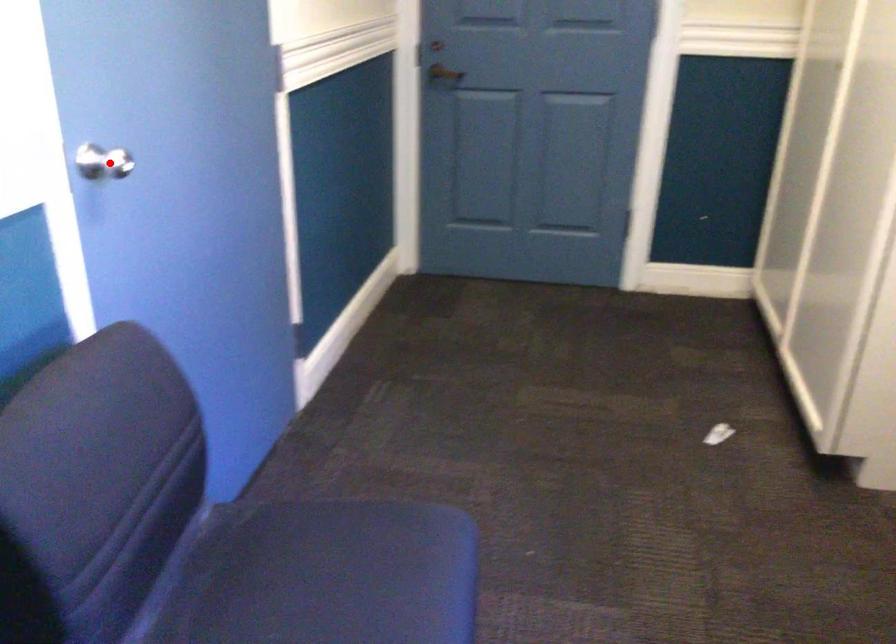
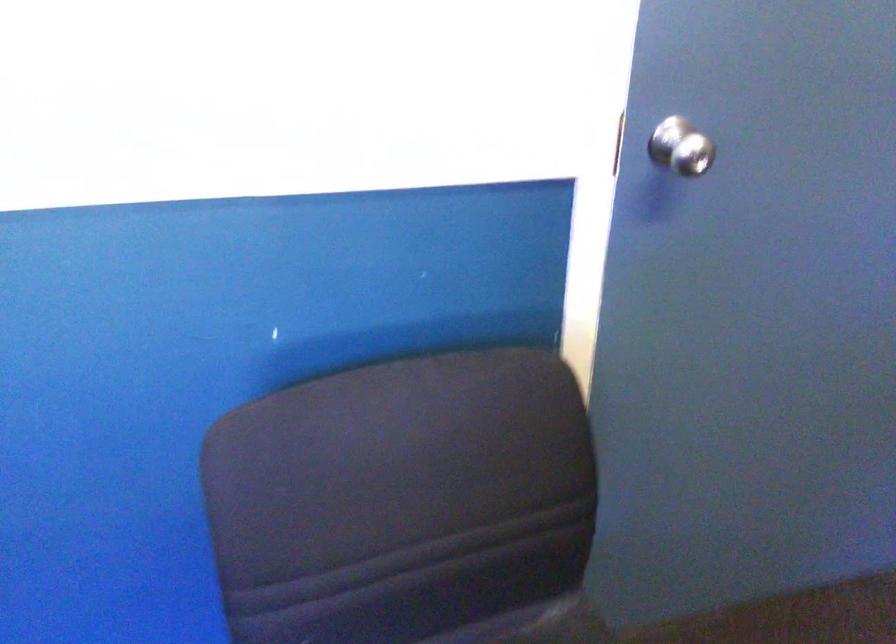
In the second image, find the point that corresponds to the highlighted location in the first image.

(681, 147)